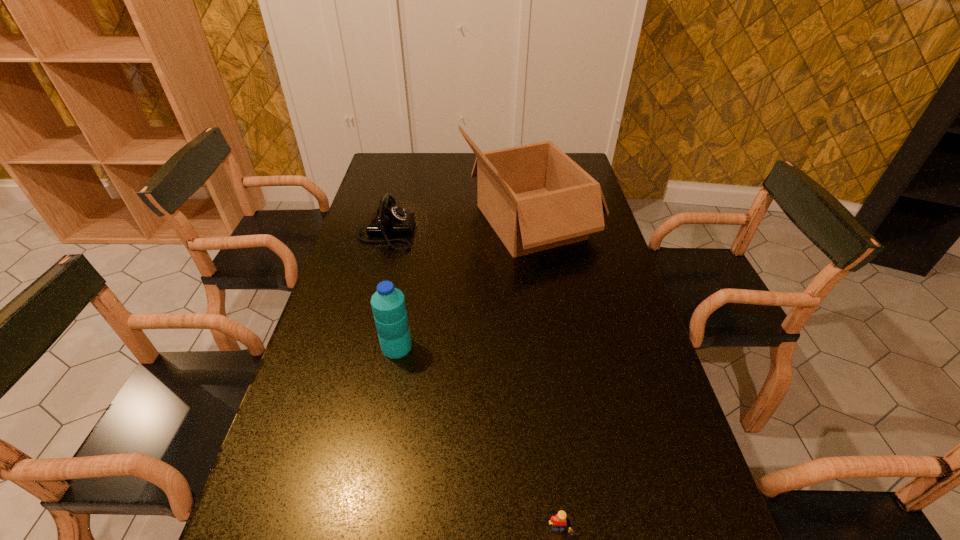
Identify the location of the tallest object. [535, 197].

At what (x,y) coordinates should I click in order to perform the action: click on the second tallest object. Please return your answer as a coordinate pair (x, y). This screenshot has height=540, width=960. Looking at the image, I should click on (388, 304).

At what (x,y) coordinates should I click in order to perform the action: click on water bottle. Please return your answer as a coordinate pair (x, y). Looking at the image, I should click on (388, 304).

I want to click on telephone, so click(x=389, y=219).

The image size is (960, 540). I want to click on vacant space located 0.250m on the left of the box, so click(389, 222).

At what (x,y) coordinates should I click in order to perform the action: click on free spot located 0.070m on the back of the second tallest object. Please return your answer as a coordinate pair (x, y). The height and width of the screenshot is (540, 960). Looking at the image, I should click on (402, 316).

This screenshot has height=540, width=960. What are the coordinates of `vacant area located on the dial of the telephone` in the screenshot? It's located at (444, 233).

The width and height of the screenshot is (960, 540). What are the coordinates of `object that is positioned at the left edge` in the screenshot? It's located at [x=389, y=219].

Identify the location of object at the right edge. (535, 197).

I want to click on blank area at the far edge, so click(x=473, y=178).